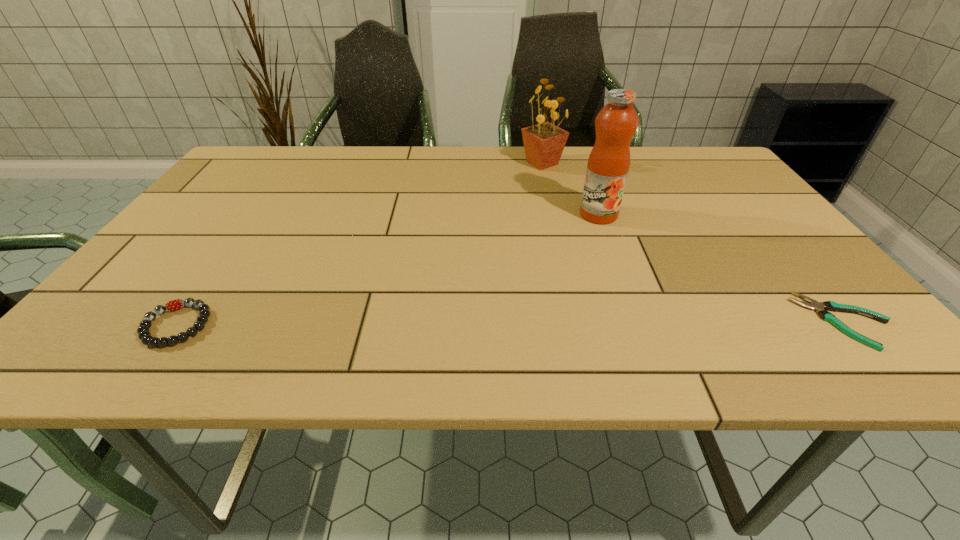
At what (x,y) coordinates should I click in order to perform the action: click on object that is at the right edge. Please return your answer as a coordinate pair (x, y). The image size is (960, 540). Looking at the image, I should click on (814, 305).

Find the location of a particular element. object that is at the near left corner is located at coordinates (144, 335).

You are a GUI agent. You are given a task and a screenshot of the screen. Output one action in this format:
    pyautogui.click(x=<x>, y=<y>)
    Task: Click on the object that is at the near right corner
    
    Given the screenshot: What is the action you would take?
    pyautogui.click(x=814, y=305)

Locate an element on the screen. The height and width of the screenshot is (540, 960). vacant space at the far edge is located at coordinates (341, 166).

At what (x,y) coordinates should I click in order to perform the action: click on vacant space at the near edge. Please return your answer as a coordinate pair (x, y). Looking at the image, I should click on (472, 319).

Find the location of a particular element. blank space at the left edge of the desktop is located at coordinates (220, 231).

What are the coordinates of `free space at the far left corner` in the screenshot? It's located at (239, 159).

The width and height of the screenshot is (960, 540). I want to click on free space at the far right corner, so click(735, 179).

Where is `free space between the pliers and the sunflower`? This screenshot has height=540, width=960. free space between the pliers and the sunflower is located at coordinates pos(693,242).

Find the location of a particular element. free spot between the third tallest object and the third shortest object is located at coordinates (359, 244).